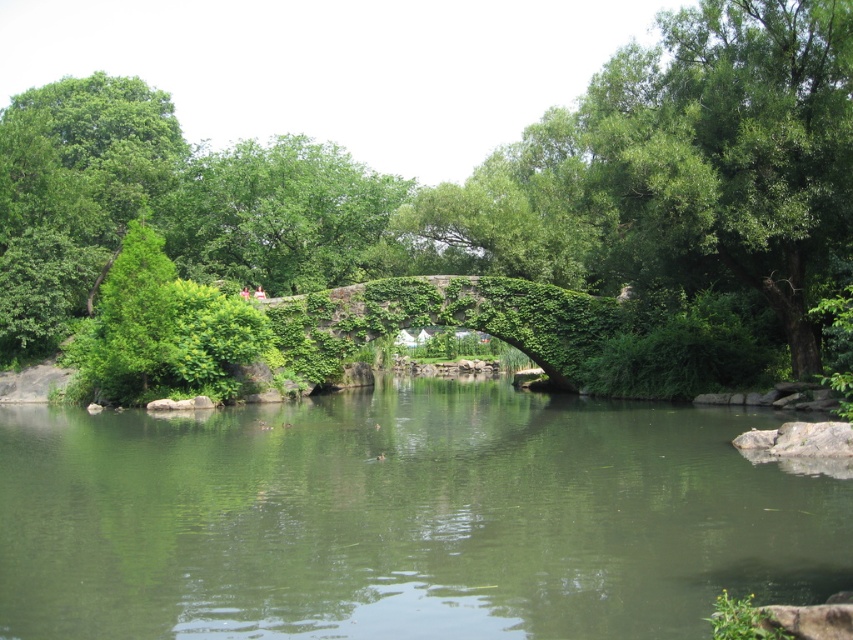
Question: Estimate the real-world distances between objects in this image. Which object is farther from the green mossy river at center?

Choices:
 (A) green leafy tree at center
 (B) green ivy-covered bridge at center

Answer: (A)

Question: Is green leafy tree at center in front of green ivy-covered bridge at center?

Choices:
 (A) yes
 (B) no

Answer: (A)

Question: Which point is farther to the camera?

Choices:
 (A) (572, 324)
 (B) (448, 483)

Answer: (A)

Question: Is green mossy river at center bigger than green ivy-covered bridge at center?

Choices:
 (A) yes
 (B) no

Answer: (A)

Question: Is green leafy tree at center thinner than green ivy-covered bridge at center?

Choices:
 (A) yes
 (B) no

Answer: (B)

Question: Which point is closer to the camera?

Choices:
 (A) green leafy tree at center
 (B) green mossy river at center

Answer: (A)